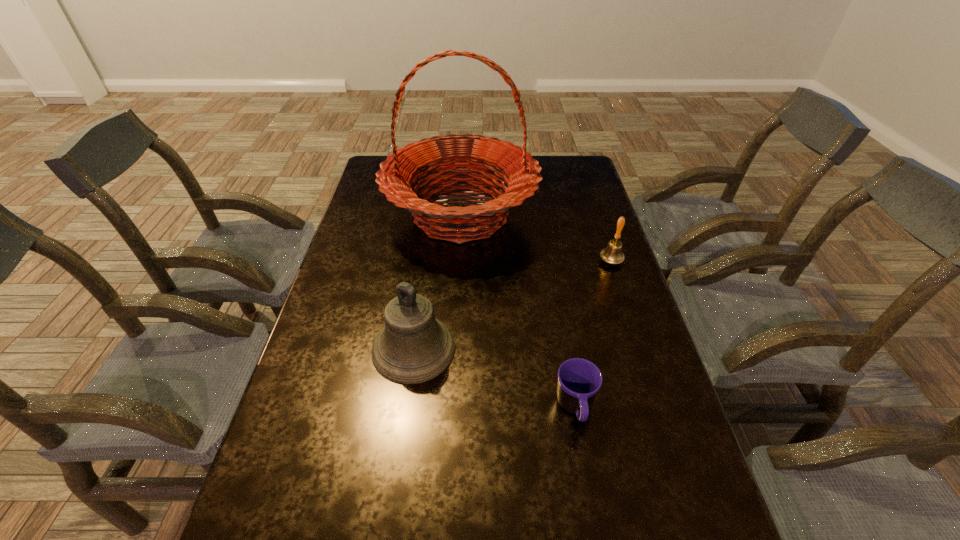
Where is `basket`? This screenshot has width=960, height=540. basket is located at coordinates (400, 171).

Locate an element on the screen. This screenshot has width=960, height=540. the nearer bell is located at coordinates (413, 347).

Find the location of a particular element. The width and height of the screenshot is (960, 540). the left bell is located at coordinates (413, 347).

Where is `the right bell`? Image resolution: width=960 pixels, height=540 pixels. the right bell is located at coordinates (612, 254).

Where is `the farther bell`? This screenshot has width=960, height=540. the farther bell is located at coordinates (612, 254).

Identify the location of mug. This screenshot has width=960, height=540. (579, 380).

I want to click on blank space located on the right of the tallest object, so click(x=584, y=215).

Identify the location of free space located on the back of the second tallest object. The image size is (960, 540). (422, 284).

Where is `vacant area situated 0.380m on the back of the shorter bell`? Image resolution: width=960 pixels, height=540 pixels. vacant area situated 0.380m on the back of the shorter bell is located at coordinates (588, 188).

Where is `vacant region located 0.160m with the handle on the side of the mug`? The height and width of the screenshot is (540, 960). vacant region located 0.160m with the handle on the side of the mug is located at coordinates (594, 516).